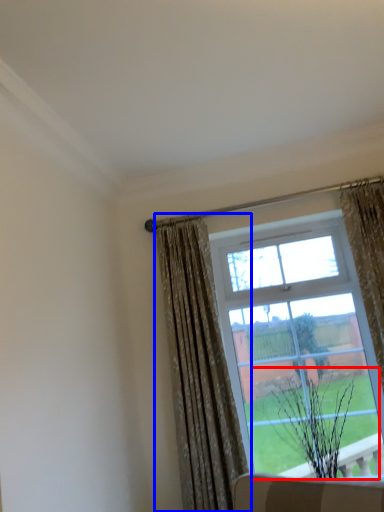
Question: Among these objects, which one is farthest to the camera, plant (highlighted by a red box) or curtain (highlighted by a blue box)?

Choices:
 (A) plant
 (B) curtain

Answer: (A)